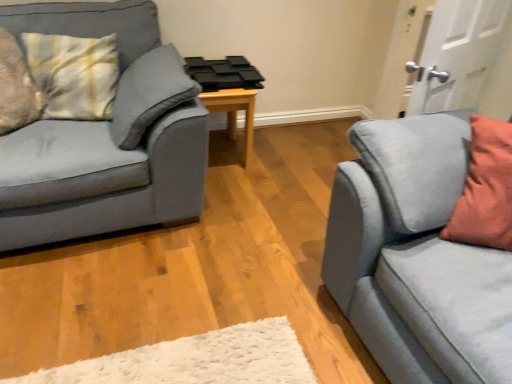
Question: From the image's perspective, would you say suede blue studio couch at right, which ranks as the second studio couch in left-to-right order, is positioned over white matte door at upper right?

Choices:
 (A) yes
 (B) no

Answer: (B)

Question: Is suede blue studio couch at right, the first studio couch from the right, smaller than white matte door at upper right?

Choices:
 (A) yes
 (B) no

Answer: (B)

Question: Is the surface of suede blue studio couch at right, the first studio couch from the right, in direct contact with white matte door at upper right?

Choices:
 (A) no
 (B) yes

Answer: (A)

Question: Can you confirm if suede blue studio couch at right, the first studio couch from the right, is thinner than white matte door at upper right?

Choices:
 (A) yes
 (B) no

Answer: (B)

Question: Is suede blue studio couch at right, which ranks as the second studio couch in left-to-right order, located outside white matte door at upper right?

Choices:
 (A) yes
 (B) no

Answer: (A)

Question: Is wooden table at center in front of or behind matte blue couch at left, the first studio couch in the left-to-right sequence, in the image?

Choices:
 (A) front
 (B) behind

Answer: (B)

Question: In terms of width, does wooden table at center look wider or thinner when compared to matte blue couch at left, the first studio couch in the left-to-right sequence?

Choices:
 (A) thin
 (B) wide

Answer: (A)

Question: From the image's perspective, is wooden table at center located above or below matte blue couch at left, which is the 2th studio couch from right to left?

Choices:
 (A) below
 (B) above

Answer: (B)

Question: Is wooden table at center spatially inside matte blue couch at left, the first studio couch in the left-to-right sequence, or outside of it?

Choices:
 (A) inside
 (B) outside

Answer: (B)

Question: In terms of width, does matte blue couch at left, the first studio couch in the left-to-right sequence, look wider or thinner when compared to suede blue studio couch at right, which ranks as the second studio couch in left-to-right order?

Choices:
 (A) wide
 (B) thin

Answer: (A)

Question: Is matte blue couch at left, the first studio couch in the left-to-right sequence, bigger or smaller than suede blue studio couch at right, the first studio couch from the right?

Choices:
 (A) small
 (B) big

Answer: (B)

Question: Considering the relative positions of matte blue couch at left, the first studio couch in the left-to-right sequence, and suede blue studio couch at right, which ranks as the second studio couch in left-to-right order, in the image provided, is matte blue couch at left, the first studio couch in the left-to-right sequence, to the left or to the right of suede blue studio couch at right, which ranks as the second studio couch in left-to-right order,?

Choices:
 (A) right
 (B) left

Answer: (B)

Question: From the image's perspective, relative to suede blue studio couch at right, which ranks as the second studio couch in left-to-right order, is matte blue couch at left, the first studio couch in the left-to-right sequence, above or below?

Choices:
 (A) above
 (B) below

Answer: (A)

Question: Does point (506, 92) appear closer or farther from the camera than point (247, 97)?

Choices:
 (A) closer
 (B) farther

Answer: (A)

Question: Considering the positions of white matte door at upper right and wooden table at center in the image, is white matte door at upper right bigger or smaller than wooden table at center?

Choices:
 (A) small
 (B) big

Answer: (A)